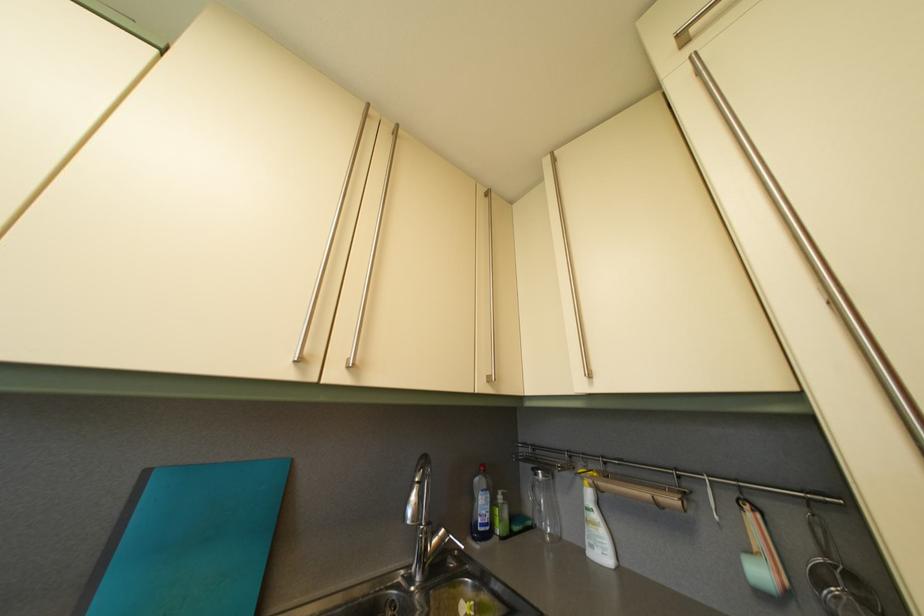
I want to click on spray bottle trigger, so click(587, 474).